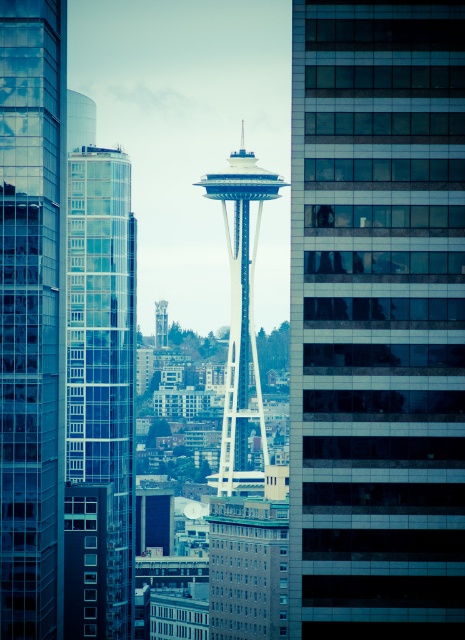
Does white glass tower at center appear under metallic silver tower at center?

No, white glass tower at center is not below metallic silver tower at center.

Which is above, white glass tower at center or metallic silver tower at center?

white glass tower at center is above.

Which is behind, point (270, 179) or point (157, 317)?

Positioned behind is point (270, 179).

You are a GUI agent. You are given a task and a screenshot of the screen. Output one action in this format:
    pyautogui.click(x=<x>, y=<y>)
    Task: Click on the white glass tower at center
    The width and height of the screenshot is (465, 640).
    Given the screenshot: What is the action you would take?
    pyautogui.click(x=241, y=323)

Which of these two, clear glass building at left or metallic silver tower at center, stands shorter?

With less height is metallic silver tower at center.

Can you confirm if clear glass building at left is bigger than metallic silver tower at center?

Yes, clear glass building at left is bigger than metallic silver tower at center.

Describe the element at coordinates (103, 355) in the screenshot. I see `clear glass building at left` at that location.

This screenshot has height=640, width=465. I want to click on clear glass building at left, so click(x=103, y=355).

Which is more to the right, clear glass building at left or white glass tower at center?

From the viewer's perspective, white glass tower at center appears more on the right side.

Between clear glass building at left and white glass tower at center, which one is positioned lower?

clear glass building at left is lower down.

Who is more forward, (120,369) or (240,276)?

Point (240,276)

I want to click on clear glass building at left, so [103, 355].